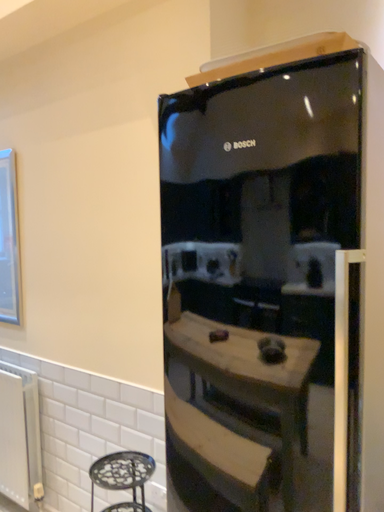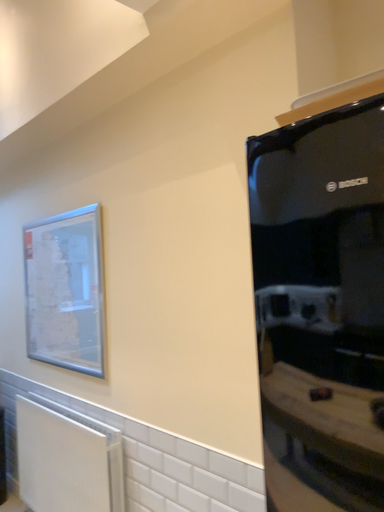
Question: Which way did the camera rotate in the video?

Choices:
 (A) rotated left
 (B) rotated right

Answer: (A)